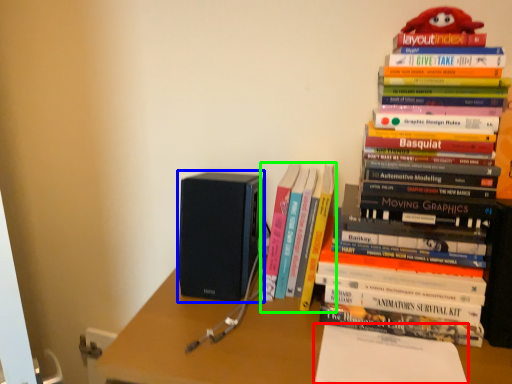
Question: Considering the real-world distances, which object is closest to paperback book (highlighted by a red box)? speaker (highlighted by a blue box) or book (highlighted by a green box).

Choices:
 (A) speaker
 (B) book

Answer: (B)